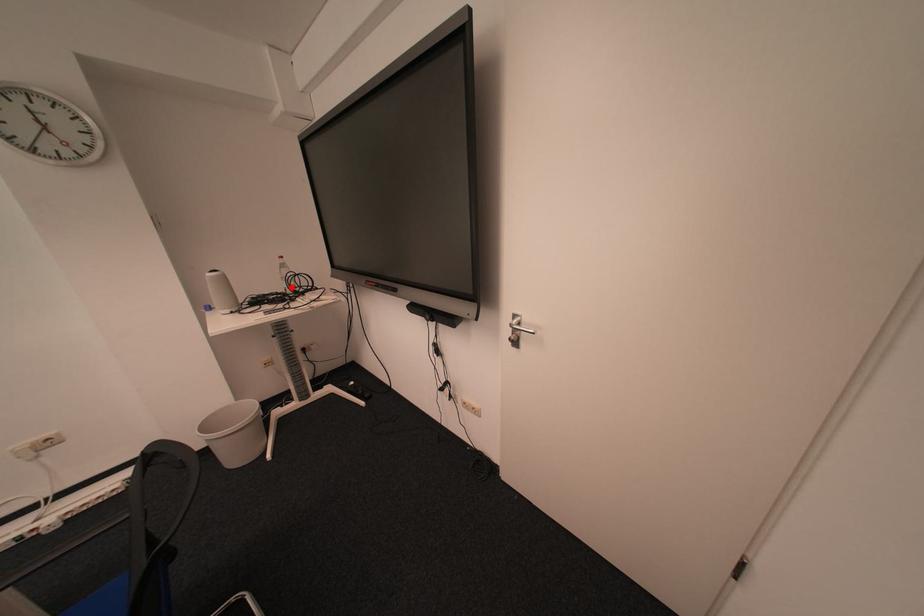
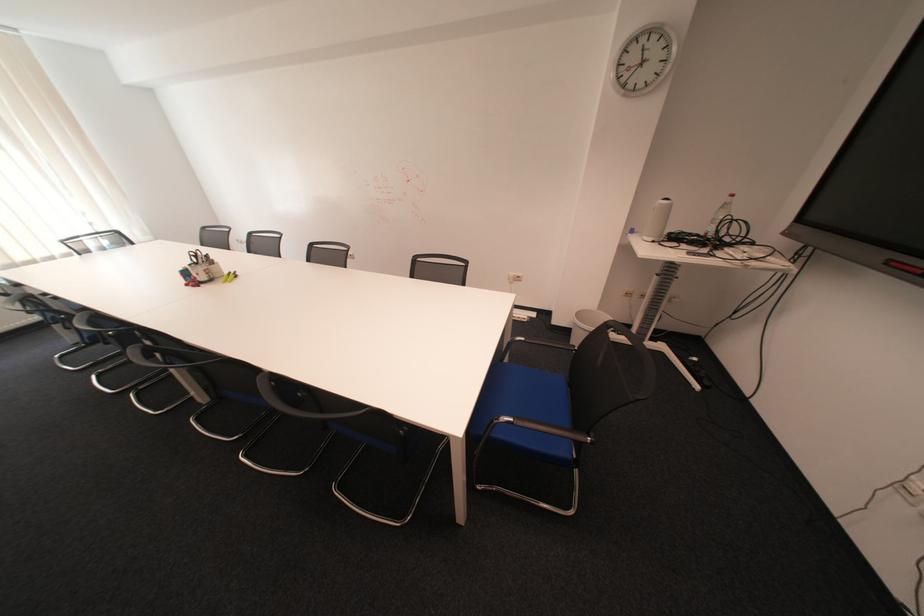
Find the pixel in the second image that matches the highlighted location in the first image.

(714, 229)